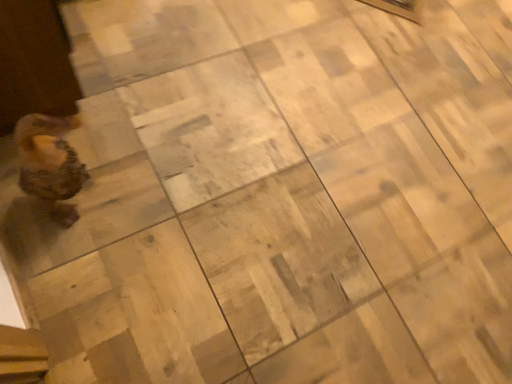
You are a GUI agent. You are given a task and a screenshot of the screen. Output one action in this format:
    pyautogui.click(x=<x>, y=<y>)
    Task: Click on the unoccupied area behind brown fabric at lower left
    Image resolution: width=512 pixels, height=384 pixels.
    Given the screenshot: What is the action you would take?
    pyautogui.click(x=117, y=30)